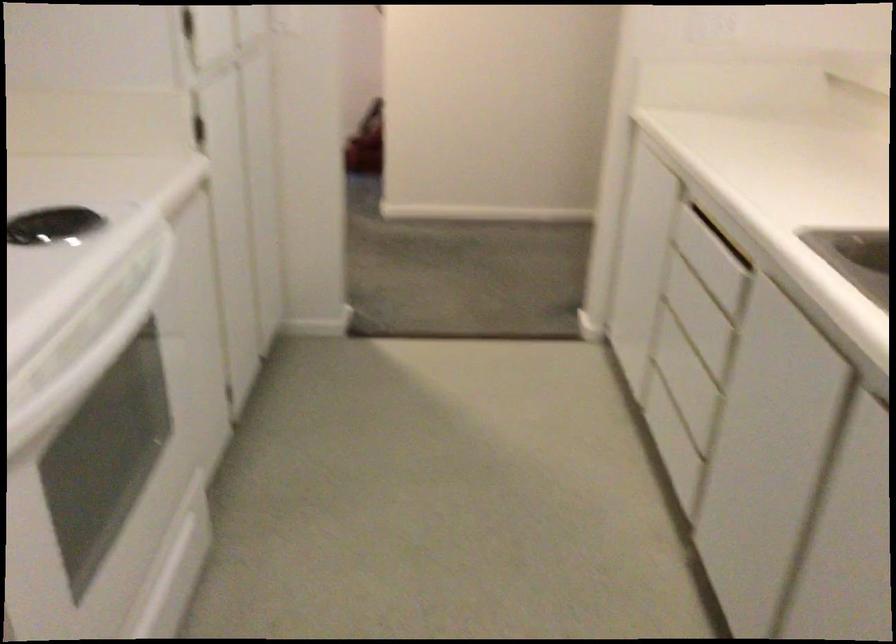
Where would you pull the white oven handle? Please return your answer as a coordinate pair (x, y).

(89, 359)